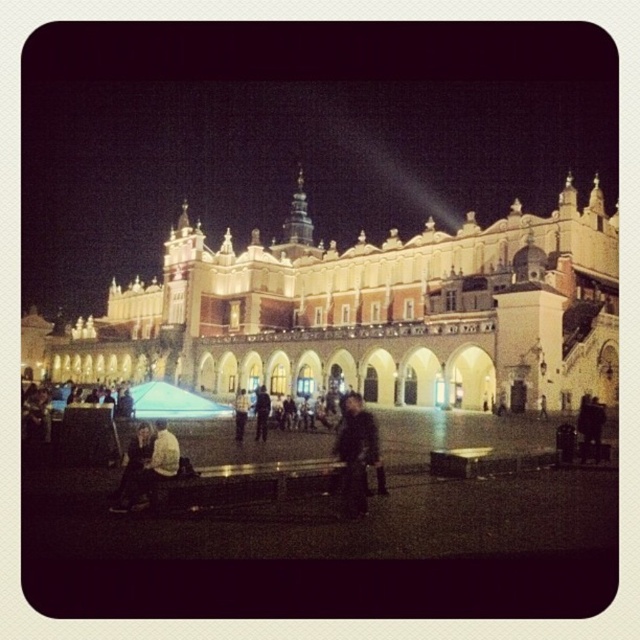
You are a photographer standing in the historic square and want to capture both the light brown leather jacket at lower left and the dark blue jacket at center in a single frame. Which jacket will appear taller in the photo?

The light brown leather jacket at lower left will appear taller in the photo because it has a greater height compared to the dark blue jacket at center.

You are a tailor who needs to determine which jacket can fit into a 1.2 meter wide display stand. Both jackets are placed at the center of the scene. Which jacket, the dark brown leather jacket at center or the light brown leather jacket at center, would fit better on the stand?

The dark brown leather jacket at center has a smaller width than the light brown leather jacket at center. Since the display stand is 1.2 meters wide, the dark brown leather jacket at center would fit better as it requires less space.